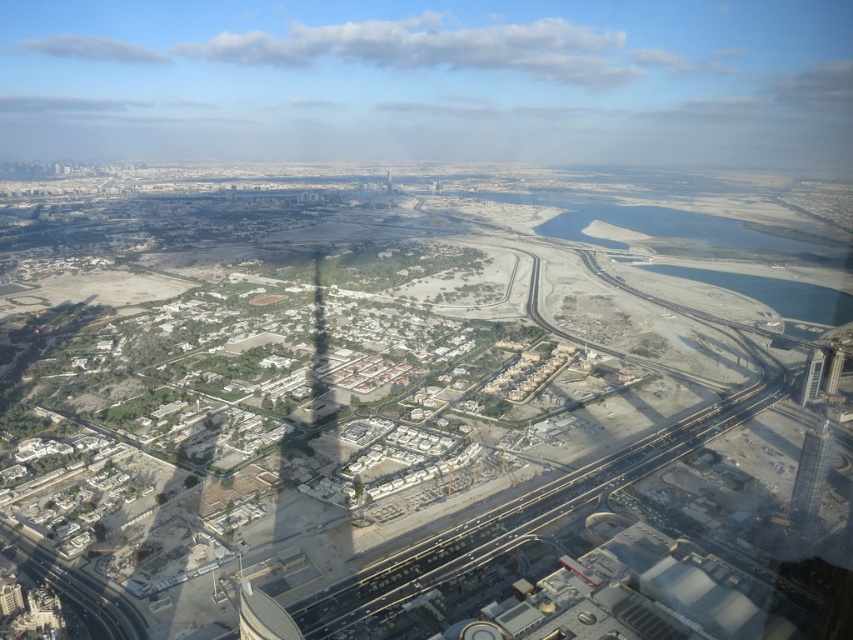
In the scene shown: You are a pilot trying to navigate through the city. You see the smooth glass tower at center and the clear glass window at center. Which one is positioned to the right side from your viewpoint?

The smooth glass tower at center is positioned to the right of the clear glass window at center, so the smooth glass tower at center is on the right side from your viewpoint.

You are a city planner reviewing this aerial image. You need to determine the spatial relationship between the metallic glass tower at right and the clear glass window at center. Based on the image, which object is positioned higher relative to the other?

The metallic glass tower at right is positioned higher than the clear glass window at center because it is described as being above it in the scene.

You are a drone operator trying to deliver a package to a specific location marked by the point at coordinates (x=813, y=355). The drone has a maximum flight range of 600 meters. Based on the cityscape image provided, will the drone be able to reach the delivery point without needing to recharge?

The point at coordinates (x=813, y=355) is 607.09 meters away from the camera, which exceeds the drone operator drone has a maximum flight range of 600 meters. Therefore, the drone will not be able to reach the delivery point without needing to recharge.